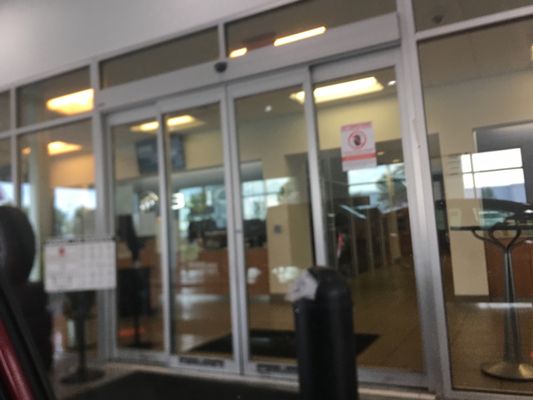
This screenshot has width=533, height=400. I want to click on fluorescent lights, so click(x=63, y=144), click(x=177, y=121), click(x=353, y=92).